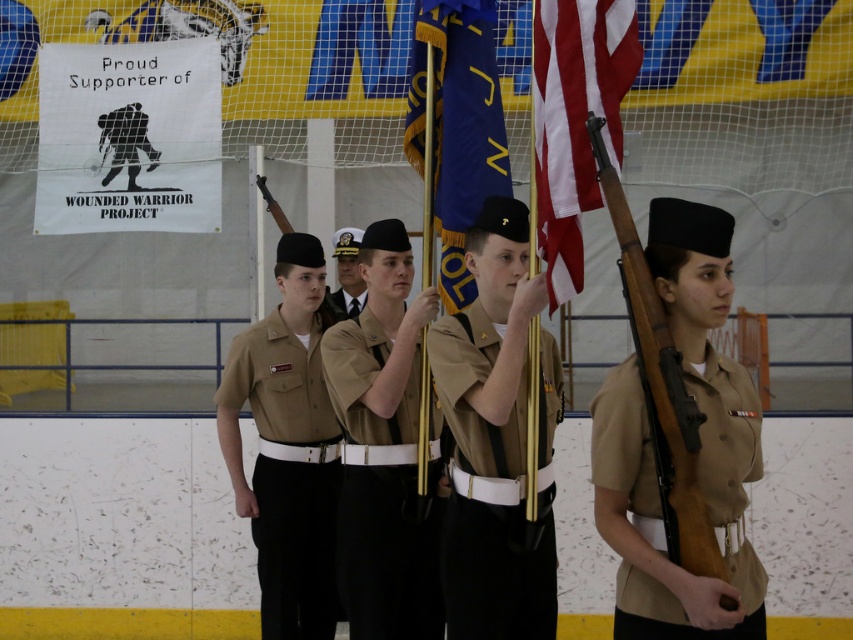
How far apart are tan fabric uniform at right and satin black tie at center?

tan fabric uniform at right is 5.89 meters from satin black tie at center.

Who is positioned more to the right, tan fabric uniform at right or satin black tie at center?

From the viewer's perspective, tan fabric uniform at right appears more on the right side.

Which is in front, point (743, 612) or point (341, 310)?

Point (743, 612)

Identify the location of tan fabric uniform at right. (651, 516).

Who is more forward, (503, 429) or (606, 128)?

Point (606, 128) is in front.

Between matte khaki uniform at center and american flag at center, which one is positioned lower?

Positioned lower is matte khaki uniform at center.

Which is behind, point (476, 595) or point (607, 3)?

Positioned behind is point (476, 595).

You are a GUI agent. You are given a task and a screenshot of the screen. Output one action in this format:
    pyautogui.click(x=<x>, y=<y>)
    Task: Click on the matte khaki uniform at center
    The height and width of the screenshot is (640, 853).
    Given the screenshot: What is the action you would take?
    pyautogui.click(x=488, y=497)

Does point (363, 582) lie in front of point (733, 394)?

That is False.

Where is `brown cotton uniform at center`? Image resolution: width=853 pixels, height=640 pixels. brown cotton uniform at center is located at coordinates (389, 552).